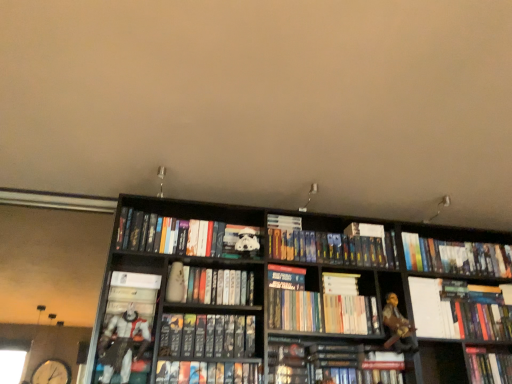
Question: Which direction should I rotate to look at hardcover book at center, marked as the 8th book in a right-to-left arrangement?

Choices:
 (A) left
 (B) right

Answer: (A)

Question: Should I look upward or downward to see white glossy book at right, which is the 2th book from right to left?

Choices:
 (A) up
 (B) down

Answer: (B)

Question: Is white matte stormtrooper helmet at center, the 2th book in the left-to-right sequence, taller than hardcover books at center, the 5th book from the right?

Choices:
 (A) yes
 (B) no

Answer: (A)

Question: Is white matte stormtrooper helmet at center, the 2th book in the left-to-right sequence, not close to hardcover books at center, arranged as the 7th book when viewed from the left?

Choices:
 (A) no
 (B) yes

Answer: (A)

Question: Can you confirm if white matte stormtrooper helmet at center, acting as the 10th book starting from the right, is positioned to the left of hardcover books at center, arranged as the 7th book when viewed from the left?

Choices:
 (A) yes
 (B) no

Answer: (A)

Question: Could you tell me if white matte stormtrooper helmet at center, the 2th book in the left-to-right sequence, is facing hardcover books at center, arranged as the 7th book when viewed from the left?

Choices:
 (A) yes
 (B) no

Answer: (B)

Question: From the image's perspective, is white matte stormtrooper helmet at center, acting as the 10th book starting from the right, beneath hardcover books at center, arranged as the 7th book when viewed from the left?

Choices:
 (A) yes
 (B) no

Answer: (B)

Question: Considering the relative sizes of white matte stormtrooper helmet at center, the 2th book in the left-to-right sequence, and hardcover books at center, arranged as the 7th book when viewed from the left, in the image provided, is white matte stormtrooper helmet at center, the 2th book in the left-to-right sequence, bigger than hardcover books at center, arranged as the 7th book when viewed from the left,?

Choices:
 (A) no
 (B) yes

Answer: (B)

Question: From the image's perspective, is hardcover books at center, arranged as the 7th book when viewed from the left, located beneath hardcover book at center, the third book from the left?

Choices:
 (A) yes
 (B) no

Answer: (B)

Question: Considering the relative sizes of hardcover books at center, the 5th book from the right, and hardcover book at center, the third book from the left, in the image provided, is hardcover books at center, the 5th book from the right, bigger than hardcover book at center, the third book from the left,?

Choices:
 (A) no
 (B) yes

Answer: (B)

Question: Can we say hardcover books at center, arranged as the 7th book when viewed from the left, lies outside hardcover book at center, the third book from the left?

Choices:
 (A) no
 (B) yes

Answer: (B)

Question: From a real-world perspective, does hardcover books at center, the 5th book from the right, stand above hardcover book at center, which appears as the ninth book when viewed from the right?

Choices:
 (A) no
 (B) yes

Answer: (B)

Question: Does hardcover books at center, arranged as the 7th book when viewed from the left, turn towards hardcover book at center, which appears as the ninth book when viewed from the right?

Choices:
 (A) no
 (B) yes

Answer: (A)

Question: Can you confirm if hardcover books at center, arranged as the 7th book when viewed from the left, is thinner than hardcover book at center, the third book from the left?

Choices:
 (A) yes
 (B) no

Answer: (A)

Question: Can you confirm if hardcover book at center, positioned as the 8th book in left-to-right order, is thinner than white matte stormtrooper helmet at center, acting as the 10th book starting from the right?

Choices:
 (A) yes
 (B) no

Answer: (A)